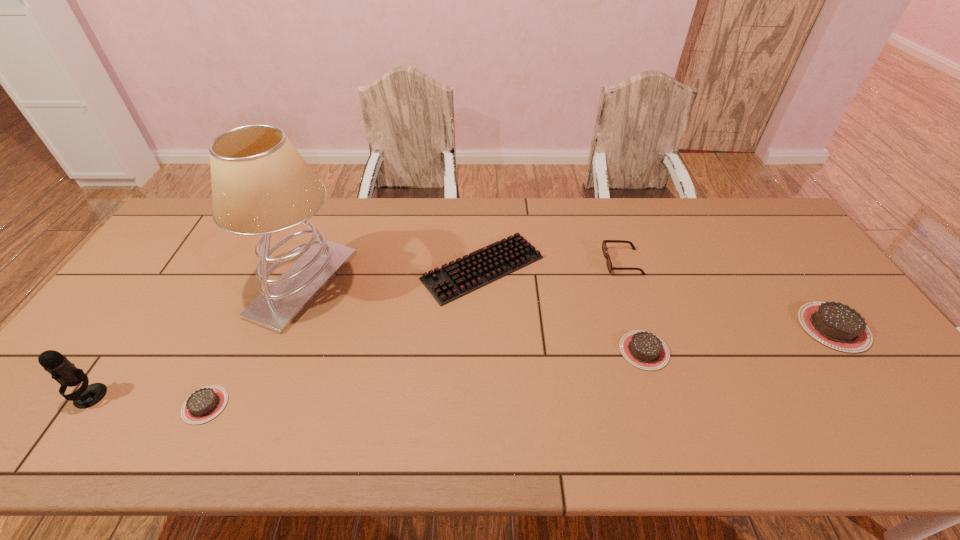
The width and height of the screenshot is (960, 540). Find the location of `vacant area between the second chocolate cake from right to left and the microphone`. vacant area between the second chocolate cake from right to left and the microphone is located at coordinates (367, 374).

What are the coordinates of `vacant area between the nearest chocolate cake and the third shortest object` in the screenshot? It's located at (424, 378).

You are a GUI agent. You are given a task and a screenshot of the screen. Output one action in this format:
    pyautogui.click(x=<x>, y=<y>)
    Task: Click on the free space between the computer keyboard and the nearest chocolate cake
    The width and height of the screenshot is (960, 540).
    Given the screenshot: What is the action you would take?
    pyautogui.click(x=344, y=337)

Find the location of a particular element. free spot between the tallest chocolate cake and the microphone is located at coordinates coord(462,362).

This screenshot has width=960, height=540. In order to click on free area in between the rightmost chocolate cake and the shortest chocolate cake in this screenshot , I will do `click(519, 366)`.

I want to click on empty space between the fifth tallest object and the computer keyboard, so click(564, 309).

Find the location of `free space between the computer keyboard and the sunglasses`. free space between the computer keyboard and the sunglasses is located at coordinates (553, 265).

You are a GUI agent. You are given a task and a screenshot of the screen. Output one action in this format:
    pyautogui.click(x=<x>, y=<y>)
    Task: Click on the object that is the sixth nearest to the computer keyboard
    The width and height of the screenshot is (960, 540).
    Given the screenshot: What is the action you would take?
    coord(62,370)

Locate which object is the sixth closest to the computer keyboard. Please provide its 2D coordinates. Your answer should be formatted as a tuple, i.e. [(x, y)], where the tuple contains the x and y coordinates of a point satisfying the conditions above.

[(62, 370)]

Point out which chocolate cake is positioned as the nearest to the microphone. Please provide its 2D coordinates. Your answer should be formatted as a tuple, i.e. [(x, y)], where the tuple contains the x and y coordinates of a point satisfying the conditions above.

[(204, 404)]